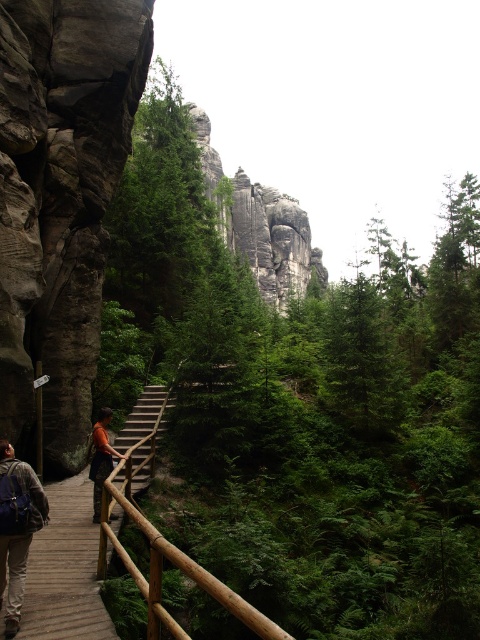
Does brown wooden rail at lower center have a smaller size compared to wooden stairs at center?

No, brown wooden rail at lower center is not smaller than wooden stairs at center.

Is brown wooden rail at lower center bigger than wooden stairs at center?

Yes, brown wooden rail at lower center is bigger than wooden stairs at center.

Is point (123, 554) in front of point (149, 396)?

Yes.

Identify the location of brown wooden rail at lower center. click(x=182, y=572).

Which is more to the left, wooden stairs at center or orange fabric shirt at center?

orange fabric shirt at center is more to the left.

Which is more to the right, wooden stairs at center or orange fabric shirt at center?

wooden stairs at center

I want to click on wooden stairs at center, so click(x=141, y=436).

Locate an element on the screen. The width and height of the screenshot is (480, 640). wooden stairs at center is located at coordinates (141, 436).

The image size is (480, 640). What do you see at coordinates (64, 570) in the screenshot?
I see `wooden walkway at center` at bounding box center [64, 570].

Between wooden walkway at center and brown wooden rail at lower center, which one appears on the left side from the viewer's perspective?

Positioned to the left is wooden walkway at center.

Is point (50, 534) positioned before point (235, 616)?

No, it is not.

In order to click on wooden walkway at center in this screenshot , I will do `click(64, 570)`.